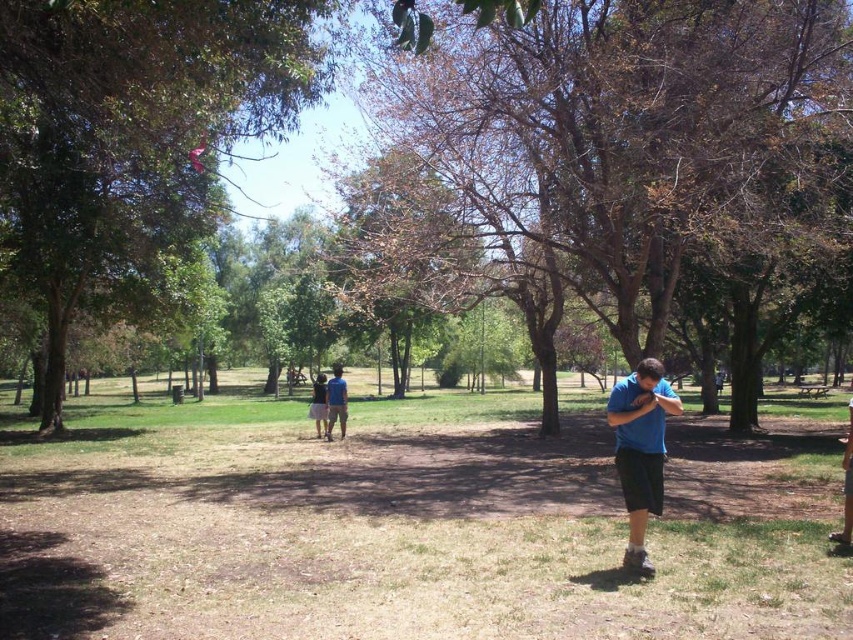
You are standing at the point labeled as point [409,522] in the park. What is the color of the grass where you are standing?

The grass at point [409,522] is brown grass at center.